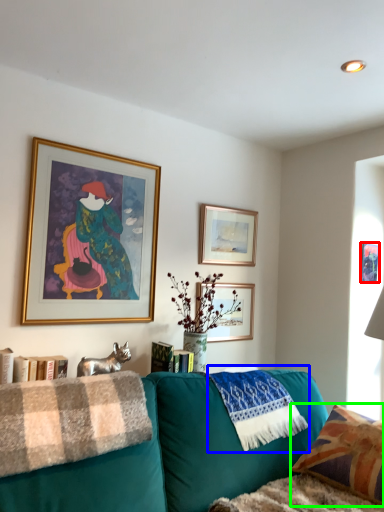
Question: Which object is positioned closest to picture frame (highlighted by a red box)? Select from material (highlighted by a blue box) and pillow (highlighted by a green box).

Choices:
 (A) material
 (B) pillow

Answer: (A)